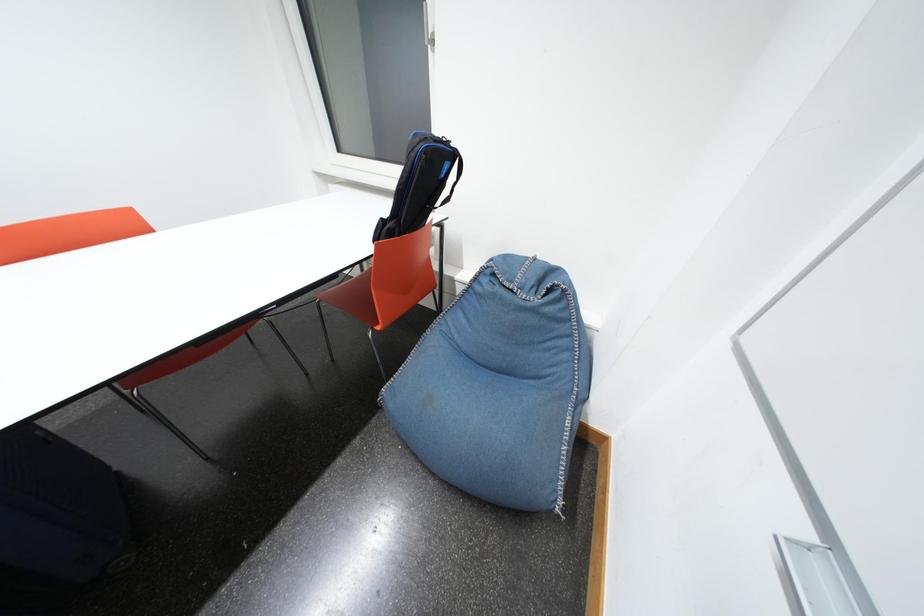
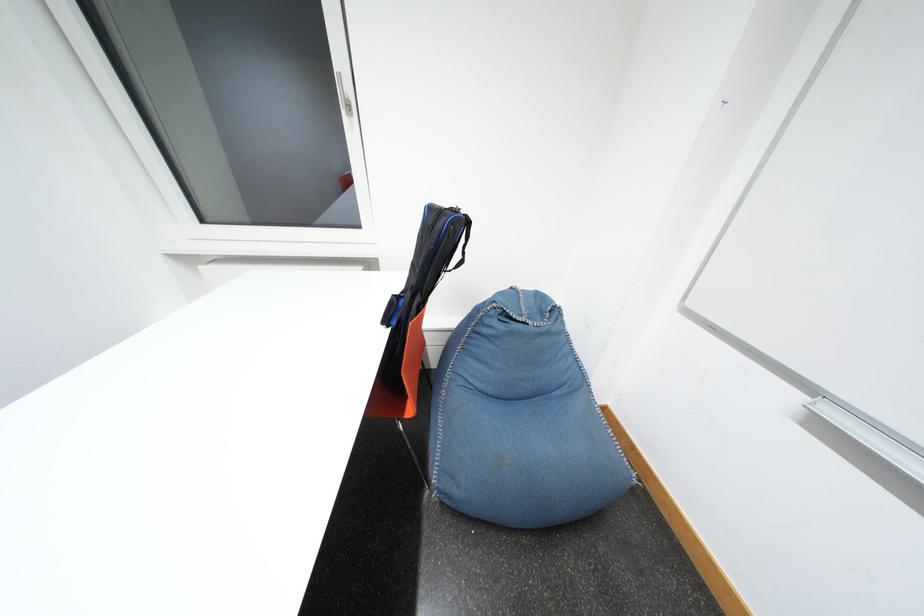
Question: The camera is either moving clockwise (left) or counter-clockwise (right) around the object. The first image is from the beginning of the video and the second image is from the end. Is the camera moving left or right when shooting the video?

Choices:
 (A) Left
 (B) Right

Answer: (A)